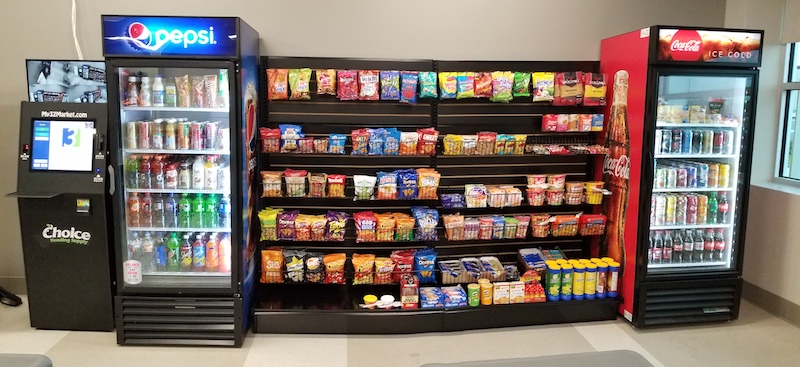
The image size is (800, 367). In order to click on shelves in this screenshot , I will do `click(410, 90)`, `click(412, 140)`, `click(402, 194)`, `click(402, 228)`, `click(404, 266)`, `click(408, 300)`.